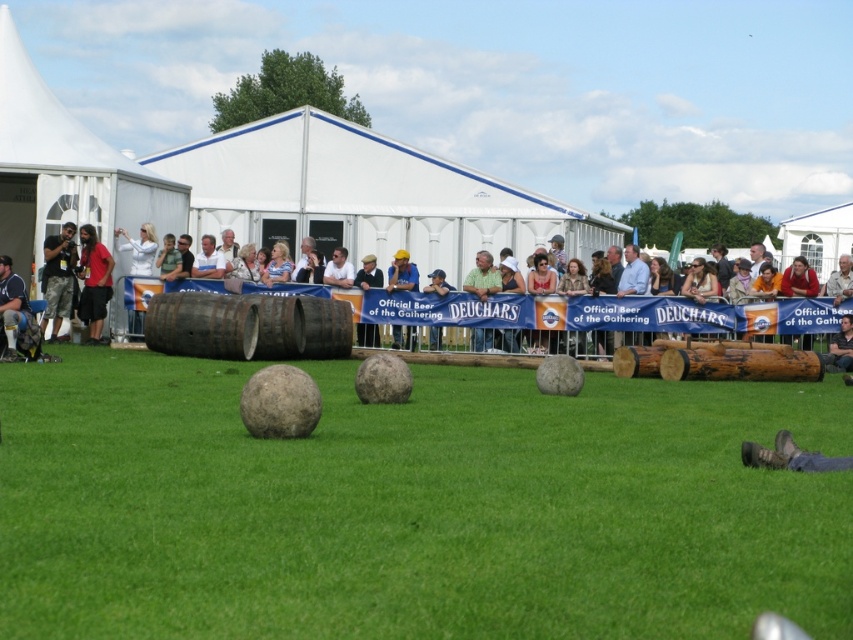
Is green grass at center positioned at the back of blue fabric cap at center?

No, it is not.

Is point (712, 560) behind point (404, 282)?

That is False.

Which is behind, point (378, 483) or point (393, 332)?

The point (393, 332) is behind.

Identify the location of green grass at center. (412, 506).

Who is positioned more to the left, green grass at center or white fabric tent at left?

white fabric tent at left is more to the left.

Can you confirm if green grass at center is bigger than white fabric tent at left?

Incorrect, green grass at center is not larger than white fabric tent at left.

Describe the element at coordinates (412, 506) in the screenshot. I see `green grass at center` at that location.

Where is `green grass at center`? green grass at center is located at coordinates (412, 506).

Can you confirm if green grass at center is positioned above camouflage pants at left?

Incorrect, green grass at center is not positioned above camouflage pants at left.

Looking at this image, is green grass at center to the left of camouflage pants at left from the viewer's perspective?

No, green grass at center is not to the left of camouflage pants at left.

Between point (585, 557) and point (67, 234), which one is positioned behind?

The point (67, 234) is behind.

Identify the location of green grass at center. This screenshot has height=640, width=853. (412, 506).